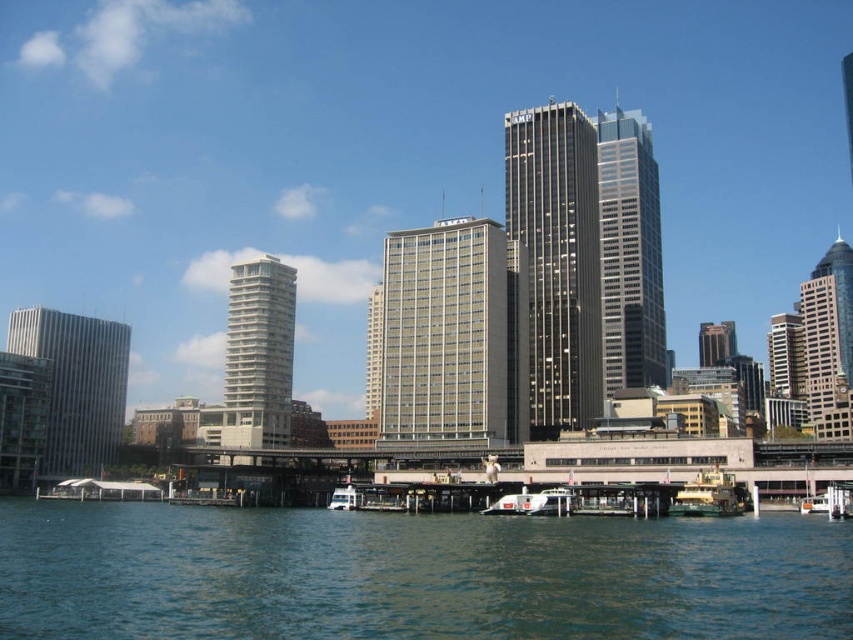
You are standing on the pier and want to take a photo of the gray concrete building at center and the dark gray glass skyscraper at center. Which one will appear larger in your camera view?

The gray concrete building at center will appear larger in your camera view because it is closer to the viewer than the dark gray glass skyscraper at center.